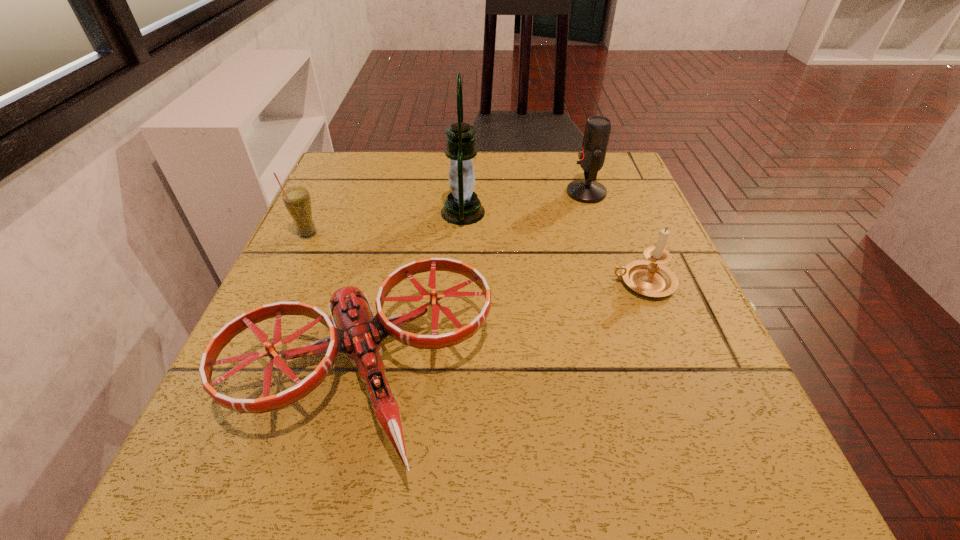
At what (x,y) coordinates should I click in order to perform the action: click on lantern. Please return your answer as a coordinate pair (x, y). Looking at the image, I should click on (462, 207).

You are a GUI agent. You are given a task and a screenshot of the screen. Output one action in this format:
    pyautogui.click(x=<x>, y=<y>)
    Task: Click on the microphone
    
    Given the screenshot: What is the action you would take?
    pyautogui.click(x=592, y=154)

Identify the location of straw for drinking. (297, 200).

Image resolution: width=960 pixels, height=540 pixels. What are the coordinates of `candle holder` in the screenshot? It's located at (650, 278).

The width and height of the screenshot is (960, 540). I want to click on drone, so click(x=356, y=331).

Find the location of `vacant area situated 0.350m on the side where the lantern emits light`. vacant area situated 0.350m on the side where the lantern emits light is located at coordinates (641, 212).

Identify the location of vacant space positioned on the side of the microphone with the red ring. (457, 193).

Find the location of `free space located on the side of the microphone with the red ring`. free space located on the side of the microphone with the red ring is located at coordinates (487, 193).

The height and width of the screenshot is (540, 960). I want to click on free space located on the side of the microphone with the red ring, so click(525, 193).

Locate an element on the screen. The height and width of the screenshot is (540, 960). vacant space located 0.320m on the back of the straw for drinking is located at coordinates tap(345, 155).